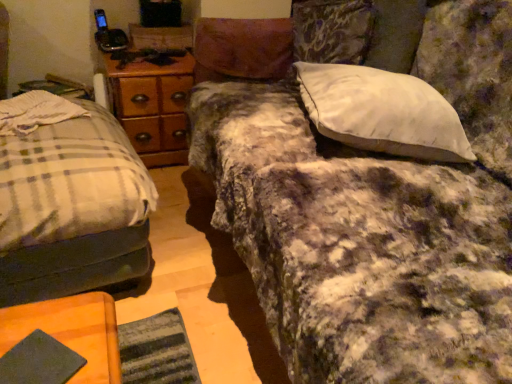
Question: Does white soft pillow at upper right lie behind plaid fabric bed at left?

Choices:
 (A) no
 (B) yes

Answer: (B)

Question: Is white soft pillow at upper right taller than plaid fabric bed at left?

Choices:
 (A) no
 (B) yes

Answer: (A)

Question: From a real-world perspective, is white soft pillow at upper right physically below plaid fabric bed at left?

Choices:
 (A) no
 (B) yes

Answer: (A)

Question: Is white soft pillow at upper right facing away from plaid fabric bed at left?

Choices:
 (A) no
 (B) yes

Answer: (A)

Question: Is plaid fabric bed at left located within white soft pillow at upper right?

Choices:
 (A) no
 (B) yes

Answer: (A)

Question: In terms of width, does wooden at left look wider or thinner when compared to plaid fabric bed at left?

Choices:
 (A) thin
 (B) wide

Answer: (A)

Question: Considering their positions, is wooden at left located in front of or behind plaid fabric bed at left?

Choices:
 (A) behind
 (B) front

Answer: (A)

Question: From a real-world perspective, is wooden at left above or below plaid fabric bed at left?

Choices:
 (A) below
 (B) above

Answer: (B)

Question: Based on their sizes in the image, would you say wooden at left is bigger or smaller than plaid fabric bed at left?

Choices:
 (A) big
 (B) small

Answer: (B)

Question: Is point (14, 352) closer or farther from the camera than point (384, 104)?

Choices:
 (A) farther
 (B) closer

Answer: (B)

Question: From the image's perspective, is dark green fabric at lower left positioned above or below white soft pillow at upper right?

Choices:
 (A) above
 (B) below

Answer: (B)

Question: Based on their sizes in the image, would you say dark green fabric at lower left is bigger or smaller than white soft pillow at upper right?

Choices:
 (A) big
 (B) small

Answer: (B)

Question: From a real-world perspective, is dark green fabric at lower left positioned above or below white soft pillow at upper right?

Choices:
 (A) below
 (B) above

Answer: (A)

Question: Is point (338, 122) closer or farther from the camera than point (434, 21)?

Choices:
 (A) closer
 (B) farther

Answer: (A)

Question: Visually, is white soft pillow at upper right positioned to the left or to the right of fluffy purple blanket at center?

Choices:
 (A) right
 (B) left

Answer: (B)